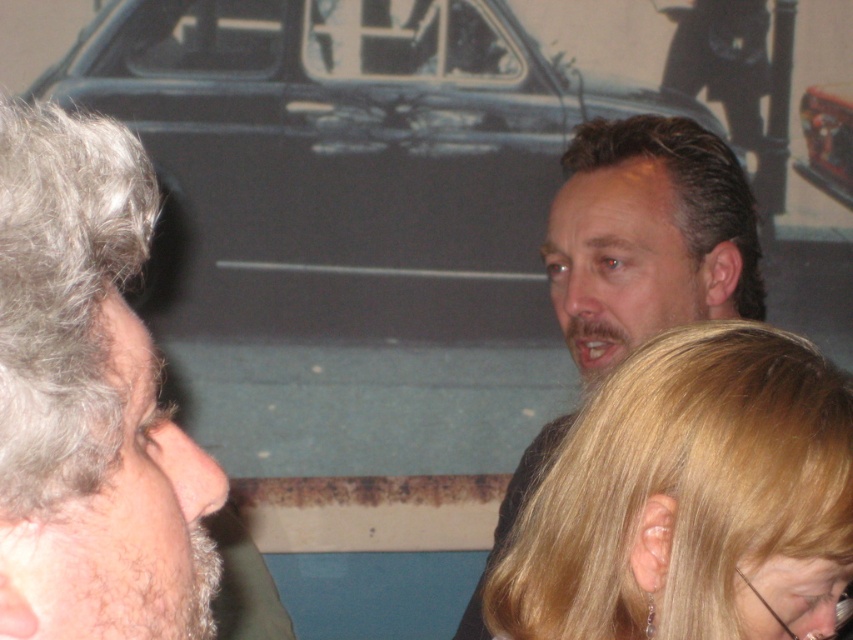
Question: Is matte black car at center closer to the viewer compared to blonde hair at center?

Choices:
 (A) no
 (B) yes

Answer: (A)

Question: Which point is closer to the camera taking this photo?

Choices:
 (A) (827, 90)
 (B) (569, 236)
 (C) (682, 504)

Answer: (C)

Question: Can you confirm if matte black car at center is thinner than shiny metallic car at upper center?

Choices:
 (A) yes
 (B) no

Answer: (B)

Question: Is matte black car at center to the right of dark brown hair at center from the viewer's perspective?

Choices:
 (A) yes
 (B) no

Answer: (B)

Question: Among these objects, which one is nearest to the camera?

Choices:
 (A) dark brown hair at center
 (B) shiny metallic car at upper center
 (C) blonde hair at center

Answer: (C)

Question: Which point is closer to the camera?

Choices:
 (A) dark brown hair at center
 (B) shiny metallic car at upper center

Answer: (A)